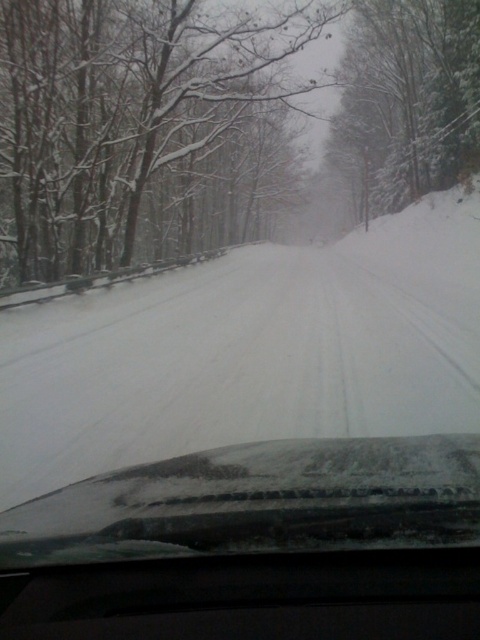
Who is higher up, snowy bark tree at center or snowy glass windshield at center?

snowy bark tree at center is higher up.

Who is more forward, (439,128) or (427,481)?

Answer: Point (427,481)

Find the location of a particular element. The height and width of the screenshot is (640, 480). snowy bark tree at center is located at coordinates (216, 124).

Identify the location of snowy bark tree at center. (216, 124).